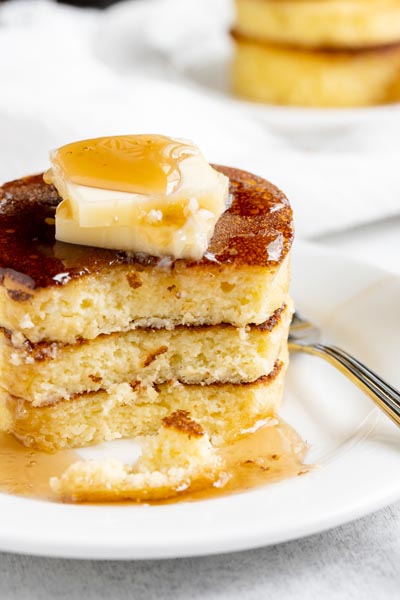
Locate an element on the screen. The width and height of the screenshot is (400, 600). fork is located at coordinates [315, 337].